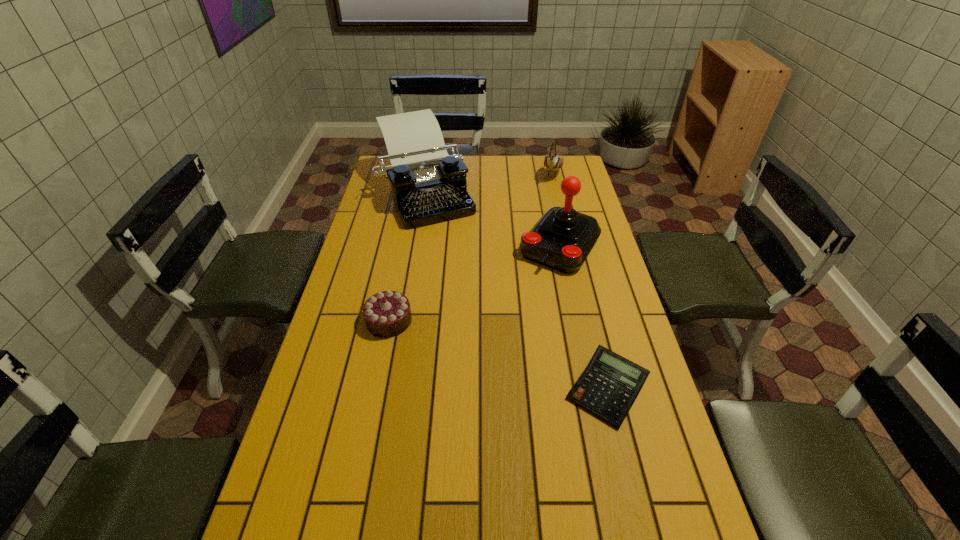
You are a GUI agent. You are given a task and a screenshot of the screen. Output one action in this format:
    pyautogui.click(x=<x>, y=<y>)
    Task: Click on the chocolate cake
    The width and height of the screenshot is (960, 540).
    Given the screenshot: What is the action you would take?
    pyautogui.click(x=386, y=314)

Find the location of a particular element. the fourth farthest object is located at coordinates (386, 314).

Identify the location of the nearest object. (608, 387).

I want to click on calculator, so click(x=608, y=387).

Identify the location of typewriter. The width and height of the screenshot is (960, 540). (429, 186).

Find the location of a particular element. The height and width of the screenshot is (540, 960). bird is located at coordinates (552, 162).

The image size is (960, 540). In order to click on joystick in this screenshot , I will do `click(562, 238)`.

This screenshot has height=540, width=960. What are the coordinates of `free location located on the back of the chocolate cake` in the screenshot? It's located at (396, 288).

Find the location of a particular element. The width and height of the screenshot is (960, 540). free spot located on the back of the calculator is located at coordinates (590, 321).

In order to click on free space located on the keys of the typewriter in this screenshot , I will do `click(458, 258)`.